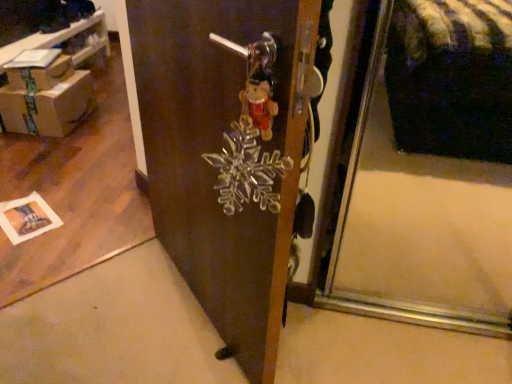
Identify the location of vacant area that is in front of cardboard box at left. (58, 152).